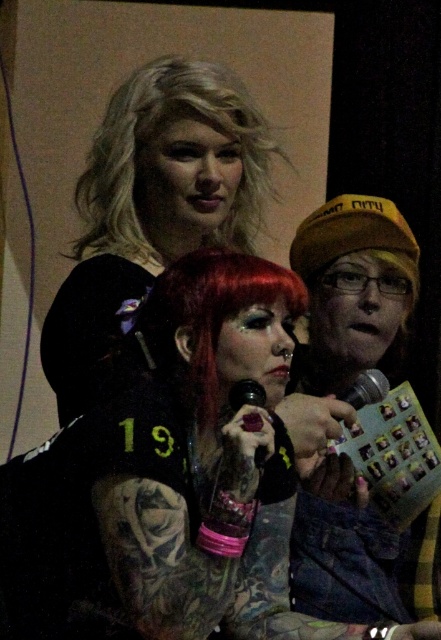
You are an event planner trying to set up a photo backdrop for the stage. The backdrop has a designated area for the blondehair at upper center and the metallic silver microphone at center. If you want the objects to appear proportional to their real sizes, which object should you make larger on the backdrop?

The blondehair at upper center should be made larger than the metallic silver microphone at center because the description states that the blondehair at upper center is larger in size than the metallic silver microphone at center.